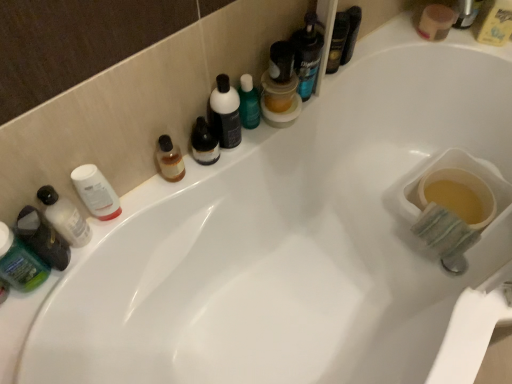
Question: Is yellow plastic bottle at upper right, which is counted as the 4th mouthwash, starting from the left, shorter than translucent plastic bottle at left, which is the second toiletry from left to right?

Choices:
 (A) no
 (B) yes

Answer: (B)

Question: Is yellow plastic bottle at upper right, the 1th mouthwash in the top-to-bottom sequence, to the left of translucent plastic bottle at left, which is the second toiletry from left to right, from the viewer's perspective?

Choices:
 (A) no
 (B) yes

Answer: (A)

Question: Is yellow plastic bottle at upper right, marked as the first mouthwash in a right-to-left arrangement, not close to translucent plastic bottle at left, which is the second toiletry from left to right?

Choices:
 (A) yes
 (B) no

Answer: (A)

Question: From the image's perspective, would you say yellow plastic bottle at upper right, positioned as the 4th mouthwash in bottom-to-top order, is positioned over translucent plastic bottle at left, which is the second toiletry from left to right?

Choices:
 (A) no
 (B) yes

Answer: (B)

Question: Is yellow plastic bottle at upper right, the 1th mouthwash in the top-to-bottom sequence, outside of translucent plastic bottle at left, which is the second toiletry from left to right?

Choices:
 (A) no
 (B) yes

Answer: (B)

Question: From a real-world perspective, relative to translucent plastic mouthwash at upper center, which is counted as the second mouthwash, starting from the right, is yellow plastic bottle at upper right, which is the first mouthwash from back to front, vertically above or below?

Choices:
 (A) below
 (B) above

Answer: (A)

Question: Considering the positions of yellow plastic bottle at upper right, the 1th mouthwash in the top-to-bottom sequence, and translucent plastic mouthwash at upper center, the 2th mouthwash in the back-to-front sequence, in the image, is yellow plastic bottle at upper right, the 1th mouthwash in the top-to-bottom sequence, taller or shorter than translucent plastic mouthwash at upper center, the 2th mouthwash in the back-to-front sequence,?

Choices:
 (A) tall
 (B) short

Answer: (B)

Question: Is yellow plastic bottle at upper right, which is the first mouthwash from back to front, spatially inside translucent plastic mouthwash at upper center, which is counted as the second mouthwash, starting from the right, or outside of it?

Choices:
 (A) inside
 (B) outside

Answer: (B)

Question: Considering the positions of yellow plastic bottle at upper right, which is the first mouthwash from back to front, and translucent plastic mouthwash at upper center, which ranks as the third mouthwash in bottom-to-top order, in the image, is yellow plastic bottle at upper right, which is the first mouthwash from back to front, bigger or smaller than translucent plastic mouthwash at upper center, which ranks as the third mouthwash in bottom-to-top order,?

Choices:
 (A) small
 (B) big

Answer: (B)

Question: Is translucent plastic jar at upper center, placed as the 2th mouthwash when sorted from front to back, to the left or to the right of white matte lotion at left, the second toiletry viewed from the right, in the image?

Choices:
 (A) right
 (B) left

Answer: (A)

Question: Is translucent plastic jar at upper center, positioned as the second mouthwash in left-to-right order, inside or outside of white matte lotion at left, the 3th toiletry when ordered from left to right?

Choices:
 (A) inside
 (B) outside

Answer: (B)

Question: From the image's perspective, is translucent plastic jar at upper center, which is the 3th mouthwash in back-to-front order, located above or below white matte lotion at left, the 3th toiletry when ordered from left to right?

Choices:
 (A) below
 (B) above

Answer: (B)

Question: From a real-world perspective, relative to white matte lotion at left, the 3th toiletry when ordered from left to right, is translucent plastic jar at upper center, which is the third mouthwash from top to bottom, vertically above or below?

Choices:
 (A) below
 (B) above

Answer: (B)

Question: Based on their positions, is green matte bottle at left, which is the first mouthwash in left-to-right order, located to the left or right of green matte lotion at left, the 1th toiletry in the left-to-right sequence?

Choices:
 (A) left
 (B) right

Answer: (A)

Question: From a real-world perspective, is green matte bottle at left, which appears as the fourth mouthwash when viewed from the right, physically located above or below green matte lotion at left, the 1th toiletry in the left-to-right sequence?

Choices:
 (A) below
 (B) above

Answer: (B)